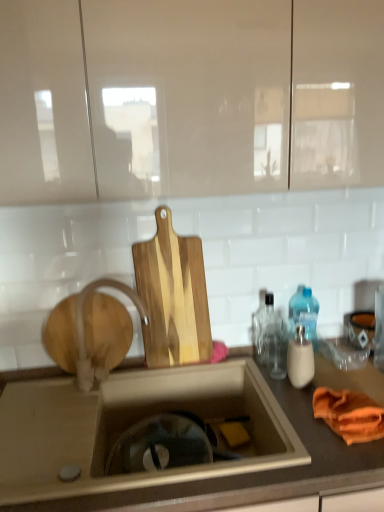
Question: Is translucent plastic bottle at right, which ranks as the third bottle in front-to-back order, at the back of white matte faucet at center?

Choices:
 (A) yes
 (B) no

Answer: (B)

Question: Is translucent plastic bottle at right, which ranks as the third bottle in front-to-back order, inside white matte faucet at center?

Choices:
 (A) no
 (B) yes

Answer: (A)

Question: Could you tell me if white matte faucet at center is facing translucent plastic bottle at right, which appears as the 1th bottle when viewed from the back?

Choices:
 (A) yes
 (B) no

Answer: (B)

Question: Is white matte faucet at center not inside translucent plastic bottle at right, which appears as the 1th bottle when viewed from the back?

Choices:
 (A) yes
 (B) no

Answer: (A)

Question: Does white matte faucet at center appear on the right side of translucent plastic bottle at right, which appears as the 1th bottle when viewed from the back?

Choices:
 (A) no
 (B) yes

Answer: (A)

Question: In terms of height, does natural wood cutting board at center look taller or shorter compared to wooden at left?

Choices:
 (A) tall
 (B) short

Answer: (A)

Question: Is point (163, 295) positioned closer to the camera than point (115, 318)?

Choices:
 (A) farther
 (B) closer

Answer: (B)

Question: In terms of size, does natural wood cutting board at center appear bigger or smaller than wooden at left?

Choices:
 (A) big
 (B) small

Answer: (A)

Question: Considering the relative positions of natural wood cutting board at center and wooden at left in the image provided, is natural wood cutting board at center to the left or to the right of wooden at left?

Choices:
 (A) left
 (B) right

Answer: (B)

Question: Based on their sizes in the image, would you say wooden at left is bigger or smaller than natural wood cutting board at center?

Choices:
 (A) big
 (B) small

Answer: (B)

Question: Considering the relative positions of wooden at left and natural wood cutting board at center in the image provided, is wooden at left to the left or to the right of natural wood cutting board at center?

Choices:
 (A) right
 (B) left

Answer: (B)

Question: In terms of width, does wooden at left look wider or thinner when compared to natural wood cutting board at center?

Choices:
 (A) thin
 (B) wide

Answer: (A)

Question: Is wooden at left spatially inside natural wood cutting board at center, or outside of it?

Choices:
 (A) inside
 (B) outside

Answer: (B)

Question: Is white matte faucet at center bigger or smaller than natural wood cutting board at center?

Choices:
 (A) small
 (B) big

Answer: (B)

Question: Is white matte faucet at center to the left or to the right of natural wood cutting board at center in the image?

Choices:
 (A) right
 (B) left

Answer: (B)